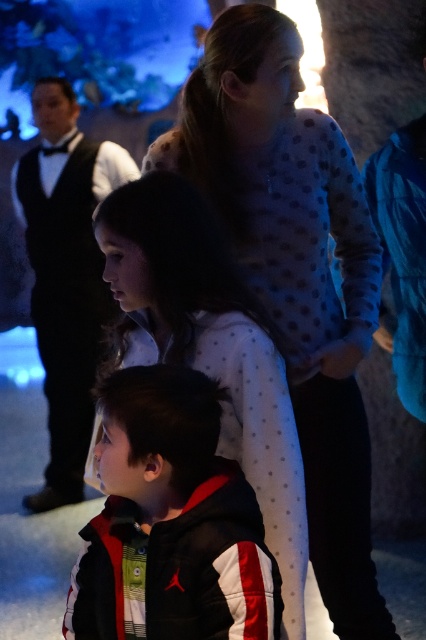
You are standing in the room and want to find the white dotted sweater at upper center. According to the coordinates provided, where should you look relative to the center of the image?

The white dotted sweater at upper center is located at coordinates point (296, 273), which means it is positioned slightly to the right and above the center of the image.

You are standing in the room and want to take a photo of both the point at location (244, 38) and the point at (285, 493). Which point should you focus on first to ensure both are in focus?

You should focus on the point at (244, 38) first because it is closer to you than the point at (285, 493). This way, the depth of field will cover both points effectively.

You are at a party and want to take a photo with the white dotted sweater at upper center and the black and white jacket at lower center. Which of the two should you stand closer to in order to ensure both are in focus?

The white dotted sweater at upper center is taller than the black and white jacket at lower center. To ensure both are in focus, you should stand closer to the taller object, which is the white dotted sweater at upper center.